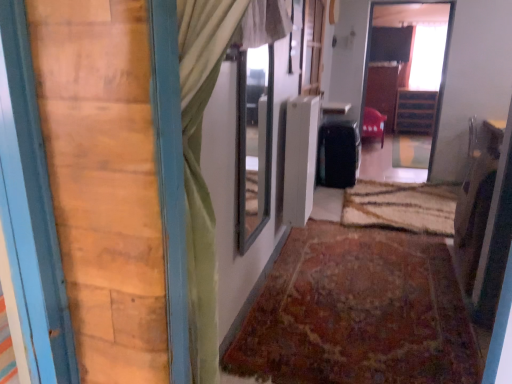
Question: Is wooden dresser at upper right not near textured brown doormat at center, the first doormat positioned from the back?

Choices:
 (A) no
 (B) yes

Answer: (B)

Question: Would you say wooden dresser at upper right is outside textured brown doormat at center, the 2th doormat when ordered from front to back?

Choices:
 (A) no
 (B) yes

Answer: (B)

Question: Does wooden dresser at upper right have a greater width compared to textured brown doormat at center, the 2th doormat when ordered from front to back?

Choices:
 (A) yes
 (B) no

Answer: (B)

Question: Can you confirm if wooden dresser at upper right is smaller than textured brown doormat at center, the 2th doormat when ordered from front to back?

Choices:
 (A) yes
 (B) no

Answer: (B)

Question: Is textured brown doormat at center, the first doormat positioned from the back, at the back of wooden dresser at upper right?

Choices:
 (A) yes
 (B) no

Answer: (B)

Question: Can you confirm if wooden dresser at upper right is positioned to the left of textured brown doormat at center, the 2th doormat when ordered from front to back?

Choices:
 (A) no
 (B) yes

Answer: (A)

Question: Is transparent glass window at upper right, which is the first window in top-to-bottom order, thinner than rug at center, marked as the 1th doormat in a front-to-back arrangement?

Choices:
 (A) yes
 (B) no

Answer: (A)

Question: Is transparent glass window at upper right, the second window from the front, facing away from rug at center, acting as the second doormat starting from the back?

Choices:
 (A) no
 (B) yes

Answer: (A)

Question: From a real-world perspective, is transparent glass window at upper right, the second window from the front, located higher than rug at center, marked as the 1th doormat in a front-to-back arrangement?

Choices:
 (A) no
 (B) yes

Answer: (B)

Question: Is transparent glass window at upper right, which is the 2th window in bottom-to-top order, at the left side of rug at center, marked as the 1th doormat in a front-to-back arrangement?

Choices:
 (A) no
 (B) yes

Answer: (A)

Question: From a real-world perspective, is transparent glass window at upper right, the second window from the front, positioned under rug at center, marked as the 1th doormat in a front-to-back arrangement, based on gravity?

Choices:
 (A) yes
 (B) no

Answer: (B)

Question: Is the depth of transparent glass window at upper right, which ranks as the 1th window in right-to-left order, greater than that of rug at center, marked as the 1th doormat in a front-to-back arrangement?

Choices:
 (A) yes
 (B) no

Answer: (A)

Question: Is wooden cabinet at center, which is the second furniture from left to right, further to the viewer compared to clear glass window at center, which is counted as the second window, starting from the top?

Choices:
 (A) no
 (B) yes

Answer: (B)